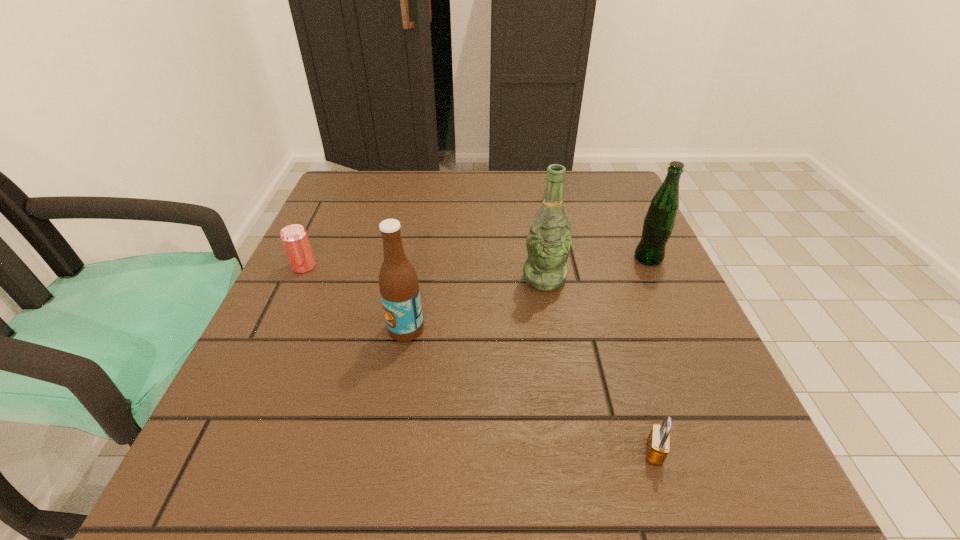
This screenshot has height=540, width=960. In order to click on blank space located 0.160m on the back of the leftmost object in this screenshot , I will do `click(326, 218)`.

Identify the location of free region located on the left of the padlock. (523, 452).

Locate an element on the screen. The width and height of the screenshot is (960, 540). object situated at the near edge is located at coordinates (658, 442).

Where is `object situated at the left edge`? object situated at the left edge is located at coordinates (294, 237).

Image resolution: width=960 pixels, height=540 pixels. What are the coordinates of `beer bottle that is at the right edge` in the screenshot? It's located at (659, 222).

The width and height of the screenshot is (960, 540). Identify the location of padlock positioned at the right edge. coord(658,442).

This screenshot has height=540, width=960. Find the location of `object situated at the near right corner`. object situated at the near right corner is located at coordinates click(658, 442).

This screenshot has width=960, height=540. I want to click on free location at the far edge, so click(x=455, y=211).

At what (x,y) coordinates should I click in order to perform the action: click on vacant space at the near edge. Please return your answer as a coordinate pair (x, y). This screenshot has height=540, width=960. Looking at the image, I should click on (351, 486).

At what (x,y) coordinates should I click in order to perform the action: click on free space at the left edge of the desktop. Please return your answer as a coordinate pair (x, y). This screenshot has height=540, width=960. Looking at the image, I should click on (316, 272).